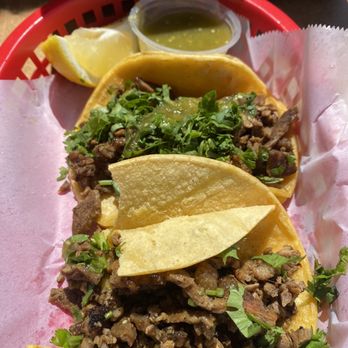
The height and width of the screenshot is (348, 348). I want to click on plastic cup, so click(227, 46).